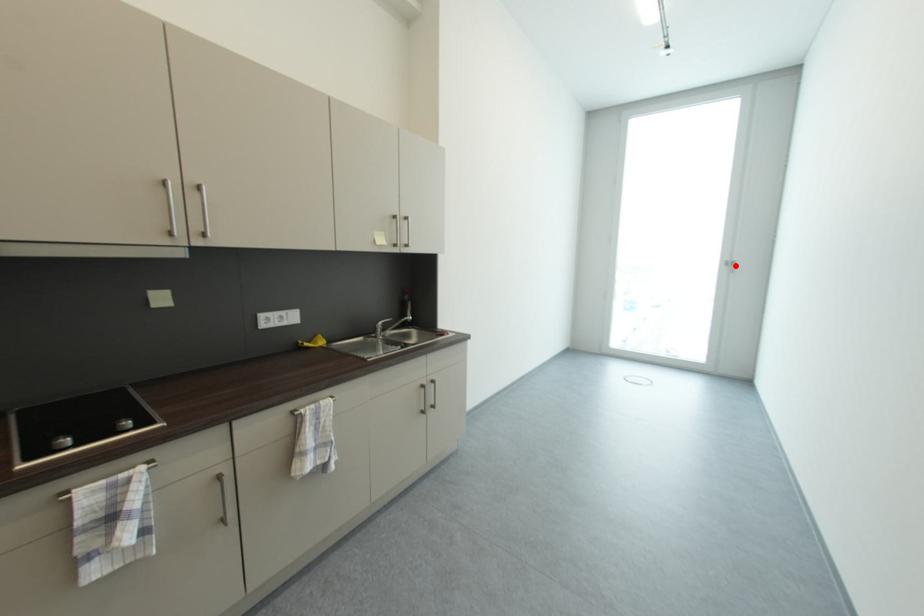
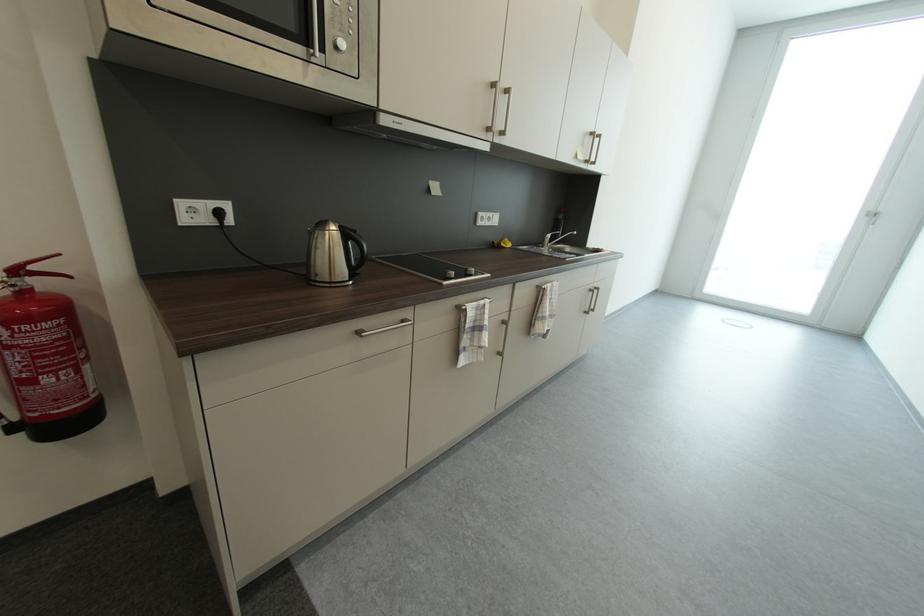
Question: A red point is marked in image1. In image2, is the corresponding 3D point closer to the camera or farther? Reply with the corresponding letter.

Choices:
 (A) The corresponding 3D point is closer.
 (B) The corresponding 3D point is farther.

Answer: (B)